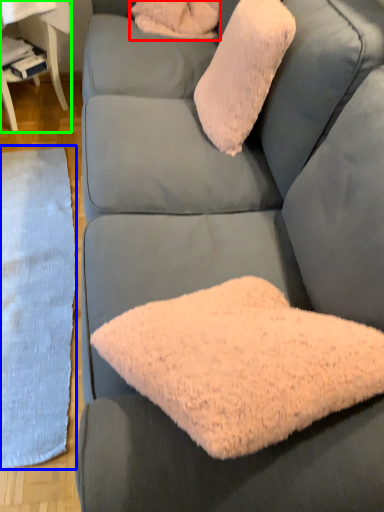
Question: Which is nearer to the pillow (highlighted by a red box)? mat (highlighted by a blue box) or table (highlighted by a green box).

Choices:
 (A) mat
 (B) table

Answer: (B)